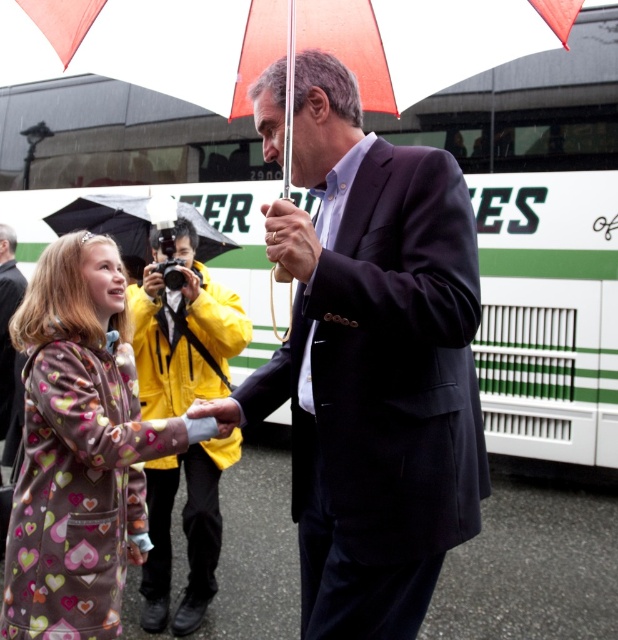
You are standing in the rain and see the scene described. There is a point marked at coordinates (78, 449). What object is located at this point?

The point at coordinates (78, 449) indicates the fluffy fleece coat at center.